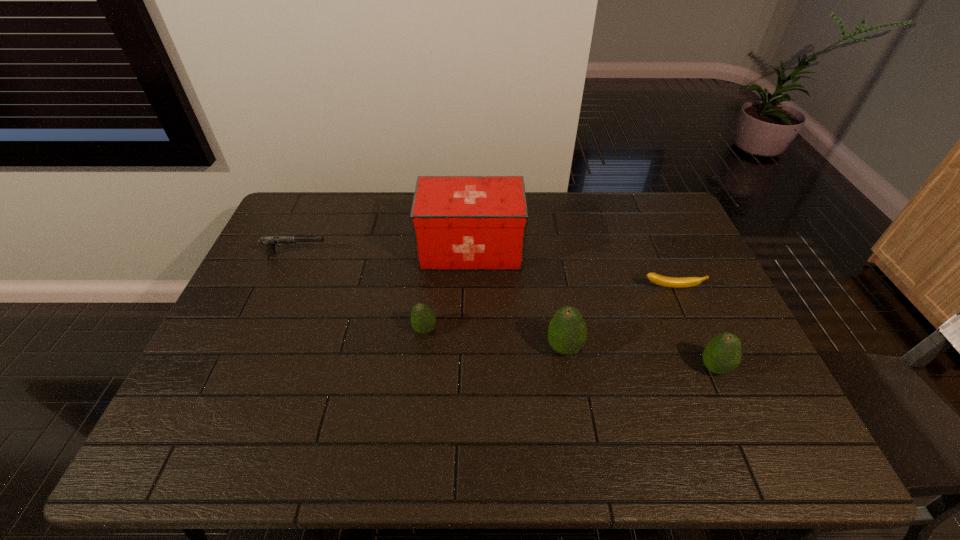
This screenshot has width=960, height=540. Find the location of `vacant point located between the fourth nearest object and the leftmost object`. vacant point located between the fourth nearest object and the leftmost object is located at coordinates (484, 271).

You are a GUI agent. You are given a task and a screenshot of the screen. Output one action in this format:
    pyautogui.click(x=<x>, y=<y>)
    Task: Click on the vacant space that's between the gun and the fourth tallest object
    Image resolution: width=960 pixels, height=540 pixels.
    Given the screenshot: What is the action you would take?
    pyautogui.click(x=360, y=292)

You are a GUI agent. You are given a task and a screenshot of the screen. Output one action in this format:
    pyautogui.click(x=<x>, y=<y>)
    Task: Click on the vacant area that lies between the shortest object and the tallest object
    This screenshot has width=960, height=540.
    Given the screenshot: What is the action you would take?
    pyautogui.click(x=571, y=268)

Find the location of a particular element. This screenshot has width=960, height=540. vacant point located between the rightmost avocado and the tallest object is located at coordinates (592, 308).

Locate an element on the screen. The width and height of the screenshot is (960, 540). free spot between the shortest object and the third tallest object is located at coordinates (693, 328).

Where is `object that can be found as the fifth closest to the first-aid kit`? object that can be found as the fifth closest to the first-aid kit is located at coordinates (722, 355).

The height and width of the screenshot is (540, 960). What are the coordinates of `object that is the second closest to the fourth object from left to right` in the screenshot? It's located at (660, 280).

Locate an element on the screen. The image size is (960, 540). avocado that is the nearest to the leftmost object is located at coordinates (423, 320).

Identify the location of avocado object that ranks as the closest to the tallest avocado. The height and width of the screenshot is (540, 960). (722, 355).

At what (x,y) coordinates should I click in order to perform the action: click on free space in the image that satisfies the following two spatial constraints: 1. at the muzzle end of the leftmost object; 2. on the back side of the shortest avocado. Please return your answer as a coordinate pair (x, y). Image resolution: width=960 pixels, height=540 pixels. Looking at the image, I should click on (263, 330).